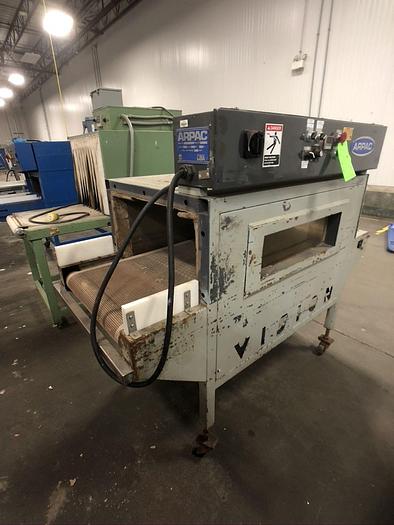
Identify the location of wall. The width and height of the screenshot is (394, 525). (216, 76).